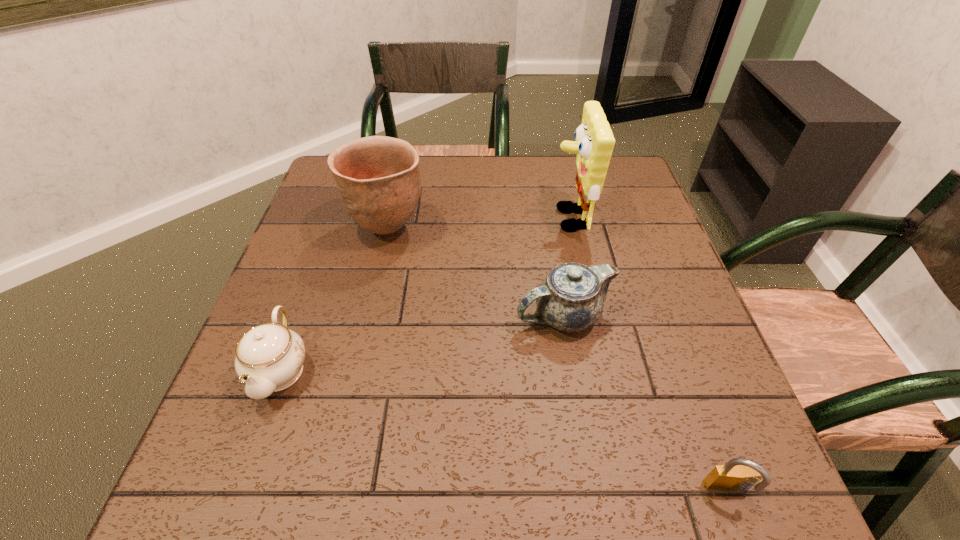
At what (x,y) coordinates should I click in order to perform the action: click on vacant area at the far edge of the desktop. Please return your answer as a coordinate pair (x, y). Looking at the image, I should click on (431, 160).

Identify the location of free space at the near edge of the desktop. (478, 483).

Image resolution: width=960 pixels, height=540 pixels. In order to click on free space at the left edge of the desktop in this screenshot , I will do `click(322, 292)`.

This screenshot has height=540, width=960. Identify the location of vacant region at the right edge of the desktop. pos(653,330).

The image size is (960, 540). In the image, there is a desktop. Find the location of `vacant space at the far right corner`. vacant space at the far right corner is located at coordinates (618, 162).

Where is `vacant space at the near right corner of the desktop`? vacant space at the near right corner of the desktop is located at coordinates (687, 498).

Identify the location of unoccupied area between the nearest object and the left chinaware. (504, 430).

Find the location of `empty space between the sponge and the rightmost object`. empty space between the sponge and the rightmost object is located at coordinates (648, 355).

Identify the location of free spot between the nearest object and the left chinaware. The height and width of the screenshot is (540, 960). (504, 430).

Where is `unoccupied position between the right chinaware and the left chinaware`? unoccupied position between the right chinaware and the left chinaware is located at coordinates (422, 342).